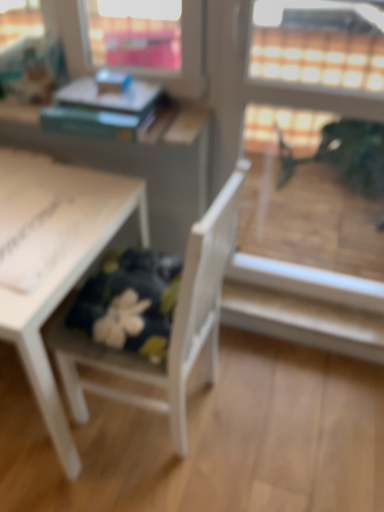
Question: From a real-world perspective, is white wood chair at lower left physically located above or below transparent glass screen door at upper right?

Choices:
 (A) above
 (B) below

Answer: (B)

Question: Considering the positions of white wood chair at lower left and transparent glass screen door at upper right in the image, is white wood chair at lower left bigger or smaller than transparent glass screen door at upper right?

Choices:
 (A) big
 (B) small

Answer: (A)

Question: Estimate the real-world distances between objects in this image. Which object is farther from the transparent glass screen door at upper right?

Choices:
 (A) hardcover book at upper left
 (B) white wood chair at lower left
 (C) white matte table at lower left

Answer: (C)

Question: Based on their relative distances, which object is nearer to the transparent glass screen door at upper right?

Choices:
 (A) white matte table at lower left
 (B) hardcover book at upper left
 (C) white wood chair at lower left

Answer: (B)